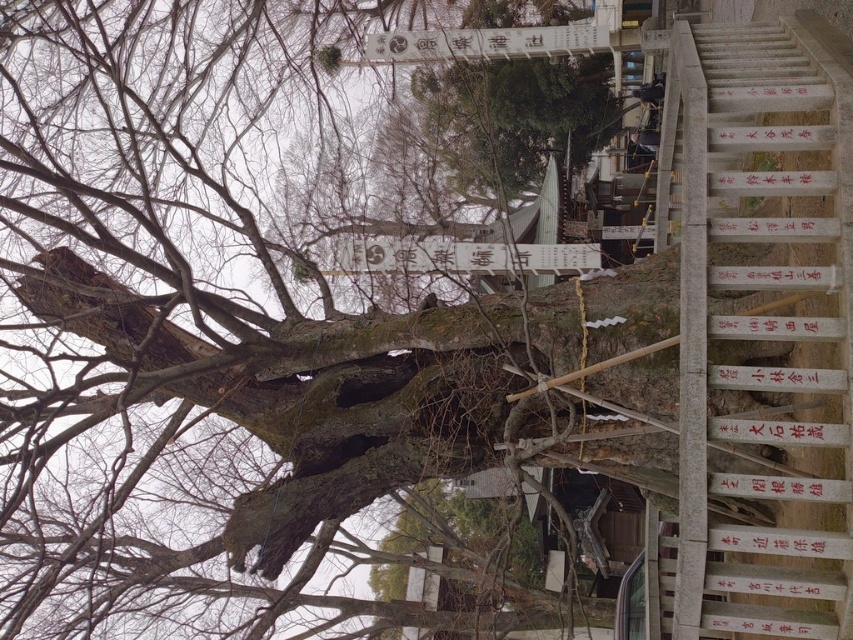
Between white stone stairs at right and white paper sign at center, which one is positioned lower?

white stone stairs at right

Can you confirm if white stone stairs at right is positioned above white paper sign at center?

Actually, white stone stairs at right is below white paper sign at center.

What do you see at coordinates (762, 323) in the screenshot? I see `white stone stairs at right` at bounding box center [762, 323].

The width and height of the screenshot is (853, 640). I want to click on white stone stairs at right, so click(762, 323).

Which is more to the left, white paper sign at center or white wood sign at upper center?

Positioned to the left is white paper sign at center.

Image resolution: width=853 pixels, height=640 pixels. Describe the element at coordinates (463, 257) in the screenshot. I see `white paper sign at center` at that location.

Between point (349, 269) and point (569, 38), which one is positioned behind?

Positioned behind is point (349, 269).

Where is `white paper sign at center`? The width and height of the screenshot is (853, 640). white paper sign at center is located at coordinates (463, 257).

Is white stone stairs at right thinner than white wood sign at upper center?

Yes, white stone stairs at right is thinner than white wood sign at upper center.

The width and height of the screenshot is (853, 640). What do you see at coordinates (762, 323) in the screenshot?
I see `white stone stairs at right` at bounding box center [762, 323].

Where is `white stone stairs at right`? The width and height of the screenshot is (853, 640). white stone stairs at right is located at coordinates (762, 323).